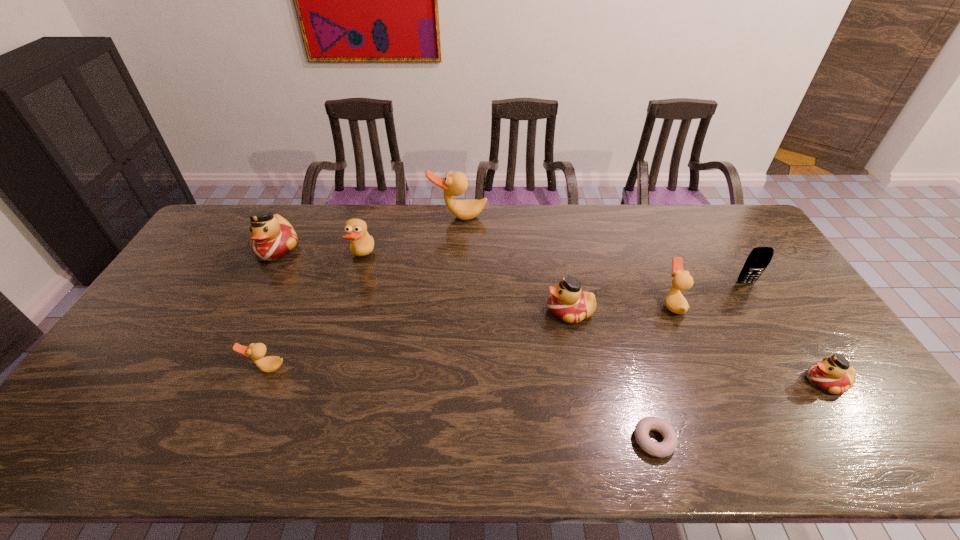
Point out which object is positioned as the second nearest to the brown doughnut. Please provide its 2D coordinates. Your answer should be formatted as a tuple, i.e. [(x, y)], where the tuple contains the x and y coordinates of a point satisfying the conditions above.

[(682, 280)]

This screenshot has height=540, width=960. I want to click on the sixth closest duck to the sixth duck from right to left, so click(x=833, y=374).

Locate which duck ranks in proximity to the sixth duck from left to right. Please provide its 2D coordinates. Your answer should be formatted as a tuple, i.e. [(x, y)], where the tuple contains the x and y coordinates of a point satisfying the conditions above.

[(567, 302)]

Locate which tan duck is the second closest to the cellular telephone. Please provide its 2D coordinates. Your answer should be formatted as a tuple, i.e. [(x, y)], where the tuple contains the x and y coordinates of a point satisfying the conditions above.

[(454, 184)]

Point out which tan duck is positioned as the nearest to the fourth duck from left to right. Please provide its 2D coordinates. Your answer should be formatted as a tuple, i.e. [(x, y)], where the tuple contains the x and y coordinates of a point satisfying the conditions above.

[(362, 244)]

Identify which red duck is the nearest to the nearest red duck. Please provide its 2D coordinates. Your answer should be formatted as a tuple, i.e. [(x, y)], where the tuple contains the x and y coordinates of a point satisfying the conditions above.

[(567, 302)]

At what (x,y) coordinates should I click in order to perform the action: click on red duck that stands as the second closest to the second farthest red duck. Please return your answer as a coordinate pair (x, y). This screenshot has width=960, height=540. Looking at the image, I should click on (273, 236).

Where is `free spot that satisfies the following two spatial constraints: 1. on the beak of the seventh object from right to left; 2. on the right side of the brown doughnut`? free spot that satisfies the following two spatial constraints: 1. on the beak of the seventh object from right to left; 2. on the right side of the brown doughnut is located at coordinates (309, 440).